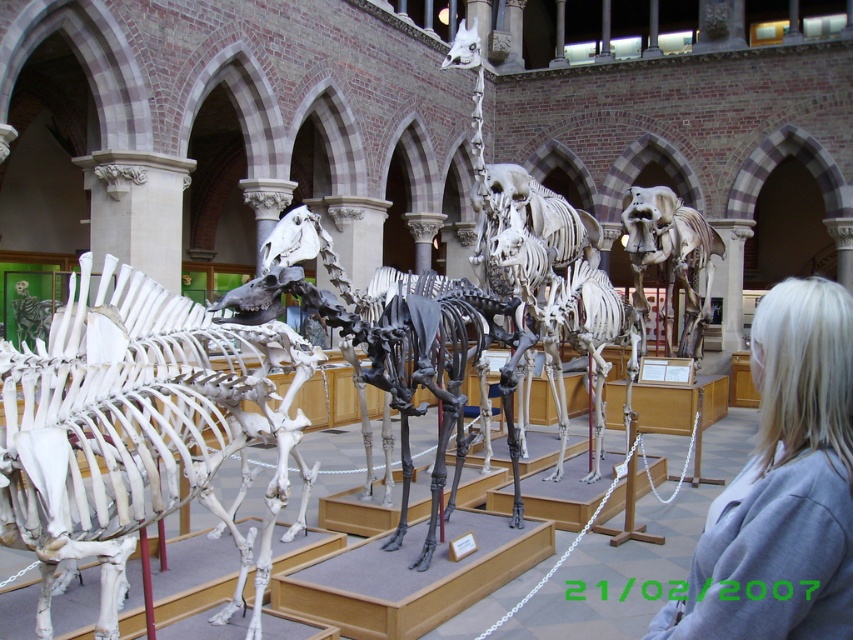
Question: Which of these objects is positioned closest to the white bone at center?

Choices:
 (A) blonde hair at center
 (B) white bone elephant at center

Answer: (A)

Question: Does blonde hair at center appear under white bone elephant at center?

Choices:
 (A) yes
 (B) no

Answer: (A)

Question: Does white bone at center lie in front of white bone elephant at center?

Choices:
 (A) no
 (B) yes

Answer: (B)

Question: Which object is positioned closest to the white bone elephant at center?

Choices:
 (A) white bone at center
 (B) blonde hair at center

Answer: (A)

Question: Is white bone at center above white bone elephant at center?

Choices:
 (A) no
 (B) yes

Answer: (A)

Question: Which object appears farthest from the camera in this image?

Choices:
 (A) white bone at center
 (B) white bone elephant at center

Answer: (B)